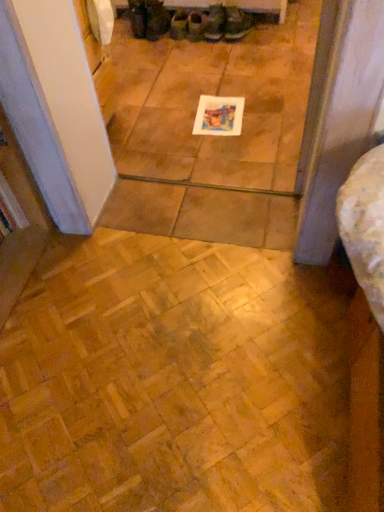
Image resolution: width=384 pixels, height=512 pixels. Find the location of `vacant space in front of white paper at center`. vacant space in front of white paper at center is located at coordinates (230, 150).